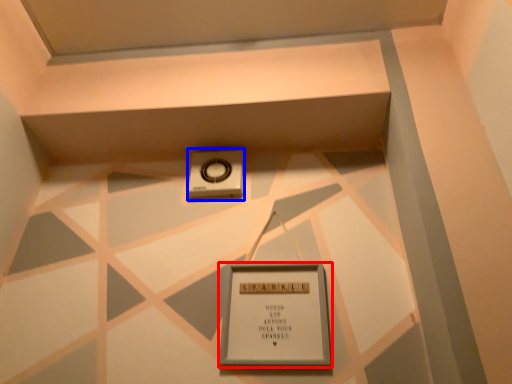
Question: Which point is closer to the camera, picture frame (highlighted by a red box) or weight scale (highlighted by a blue box)?

Choices:
 (A) picture frame
 (B) weight scale

Answer: (A)